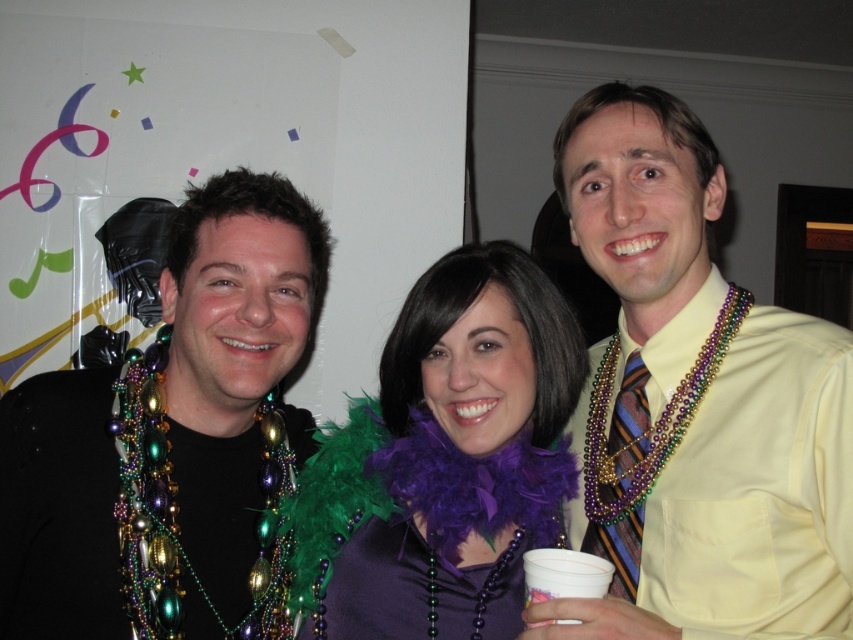
Is metallic beaded necklace at left thinner than purple feather boa at center?

Incorrect, metallic beaded necklace at left's width is not less than purple feather boa at center's.

Can you confirm if metallic beaded necklace at left is smaller than purple feather boa at center?

Incorrect, metallic beaded necklace at left is not smaller in size than purple feather boa at center.

Which is behind, point (257, 550) or point (392, 625)?

The point (257, 550) is more distant.

You are a GUI agent. You are given a task and a screenshot of the screen. Output one action in this format:
    pyautogui.click(x=<x>, y=<y>)
    Task: Click on the metallic beaded necklace at left
    The image size is (853, 640).
    Given the screenshot: What is the action you would take?
    pyautogui.click(x=233, y=355)

Does yellow satin shirt at center have a lesser height compared to striped silk tie at center-right?

No.

Which of these two, yellow satin shirt at center or striped silk tie at center-right, stands shorter?

striped silk tie at center-right

Is point (679, 397) positioned in front of point (641, 413)?

Yes, it is.

Where is `yellow satin shirt at center`? yellow satin shirt at center is located at coordinates (695, 404).

Does purple feather boa at center have a greater height compared to striped silk tie at center-right?

Yes.

Is point (425, 524) positioned in front of point (619, 424)?

Yes.

Which is behind, point (375, 621) or point (589, 540)?

The point (589, 540) is behind.

Locate an element on the screen. The width and height of the screenshot is (853, 640). purple feather boa at center is located at coordinates (454, 454).